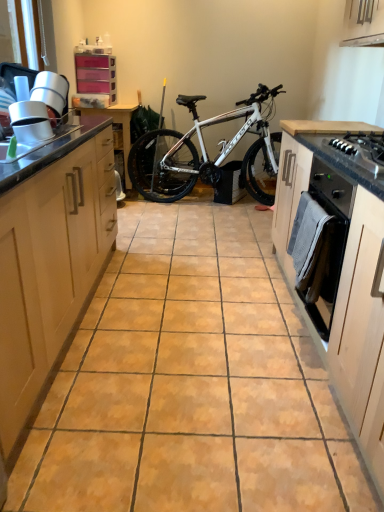
Question: Does black matte oven at right turn towards light wood oven at right, which ranks as the first cabinetry in right-to-left order?

Choices:
 (A) no
 (B) yes

Answer: (A)

Question: From a real-world perspective, does black matte oven at right sit lower than light wood oven at right, which ranks as the first cabinetry in right-to-left order?

Choices:
 (A) yes
 (B) no

Answer: (A)

Question: Is black matte oven at right positioned far away from light wood oven at right, which ranks as the first cabinetry in right-to-left order?

Choices:
 (A) yes
 (B) no

Answer: (B)

Question: Does black matte oven at right lie behind light wood oven at right, which ranks as the first cabinetry in right-to-left order?

Choices:
 (A) no
 (B) yes

Answer: (B)

Question: Considering the relative sizes of black matte oven at right and light wood oven at right, which ranks as the first cabinetry in right-to-left order, in the image provided, is black matte oven at right taller than light wood oven at right, which ranks as the first cabinetry in right-to-left order,?

Choices:
 (A) yes
 (B) no

Answer: (B)

Question: From the image's perspective, would you say black matte oven at right is positioned over light wood oven at right, which ranks as the first cabinetry in right-to-left order?

Choices:
 (A) no
 (B) yes

Answer: (B)

Question: Is wooden table at center facing towards light wood oven at right, placed as the second cabinetry when sorted from left to right?

Choices:
 (A) yes
 (B) no

Answer: (B)

Question: Considering the relative sizes of wooden table at center and light wood oven at right, placed as the second cabinetry when sorted from left to right, in the image provided, is wooden table at center wider than light wood oven at right, placed as the second cabinetry when sorted from left to right,?

Choices:
 (A) yes
 (B) no

Answer: (A)

Question: From the image's perspective, is wooden table at center on light wood oven at right, placed as the second cabinetry when sorted from left to right?

Choices:
 (A) no
 (B) yes

Answer: (B)

Question: Is wooden table at center not close to light wood oven at right, placed as the second cabinetry when sorted from left to right?

Choices:
 (A) no
 (B) yes

Answer: (B)

Question: Is wooden table at center facing away from light wood oven at right, placed as the second cabinetry when sorted from left to right?

Choices:
 (A) no
 (B) yes

Answer: (A)

Question: Can you see wooden table at center touching light wood oven at right, which ranks as the first cabinetry in right-to-left order?

Choices:
 (A) yes
 (B) no

Answer: (B)

Question: Is black glossy gas stove at right not inside black matte oven at right?

Choices:
 (A) yes
 (B) no

Answer: (A)